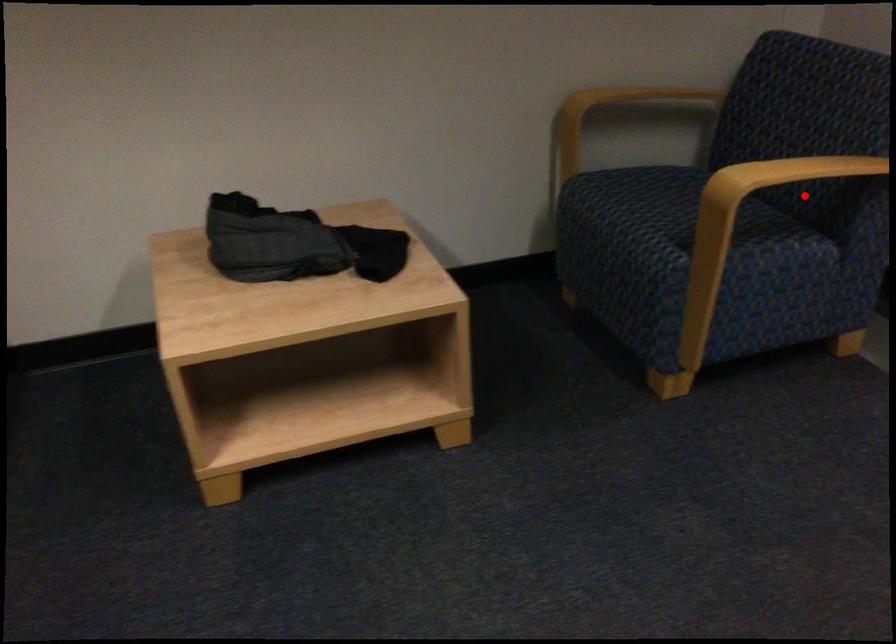
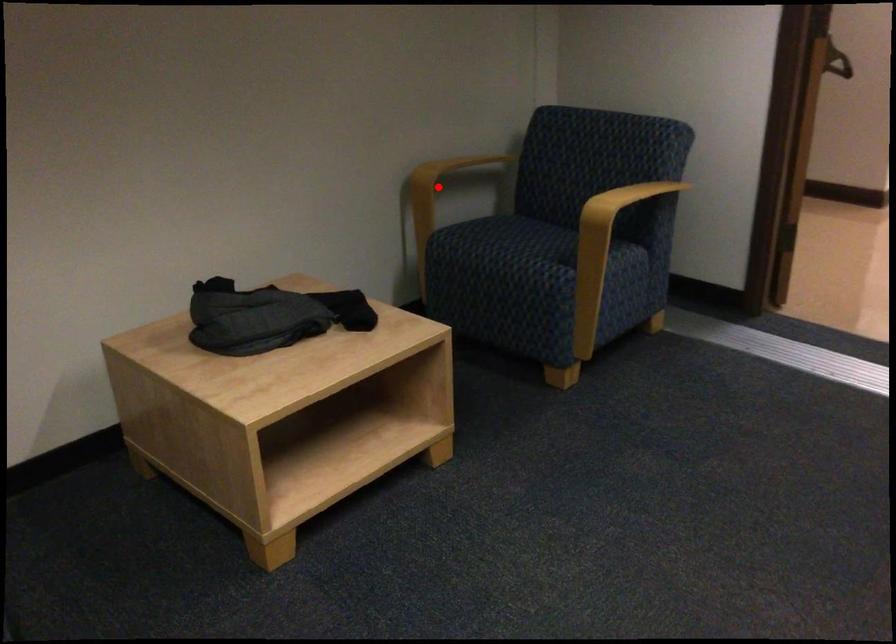
I am providing you with two images of the same scene from different viewpoints. A red point is marked on the first image and another point is marked on the second image. Is the marked point in image1 the same physical position as the marked point in image2?

No